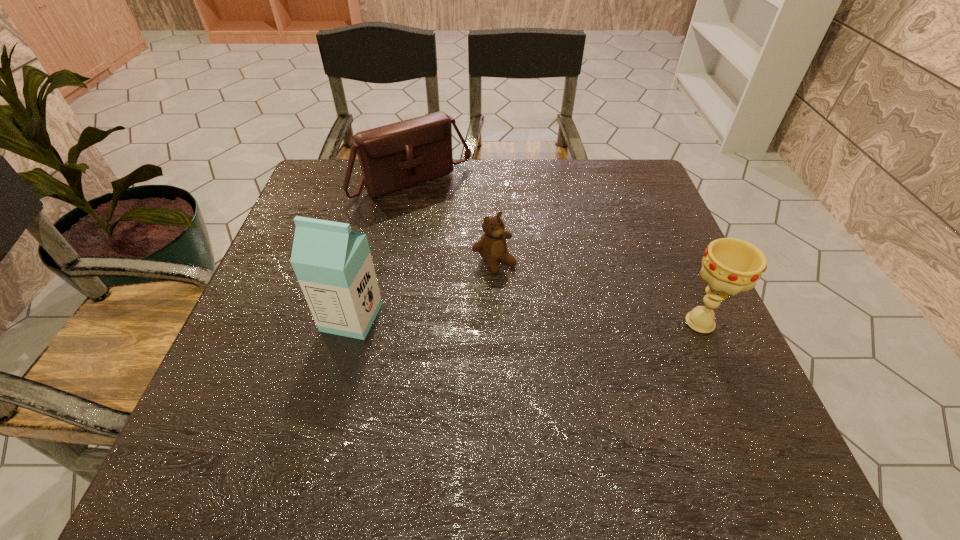
Identify the location of vacant space situated 0.290m at the face of the second farthest object. The height and width of the screenshot is (540, 960). (590, 369).

The width and height of the screenshot is (960, 540). I want to click on vacant space located 0.400m at the face of the second farthest object, so click(x=632, y=416).

This screenshot has width=960, height=540. Identify the location of free space located at the face of the second farthest object. (535, 306).

Image resolution: width=960 pixels, height=540 pixels. Identify the location of object positioned at the far edge. (396, 156).

Where is `milk carton that is at the left edge`? milk carton that is at the left edge is located at coordinates (333, 264).

Where is `shoulder bag that is at the left edge`? Image resolution: width=960 pixels, height=540 pixels. shoulder bag that is at the left edge is located at coordinates click(x=396, y=156).

This screenshot has width=960, height=540. Identify the location of object located in the right edge section of the desktop. (729, 266).

This screenshot has height=540, width=960. I want to click on object that is at the far left corner, so click(x=396, y=156).

This screenshot has width=960, height=540. Find the location of `blank space at the far edge of the desktop`. blank space at the far edge of the desktop is located at coordinates (442, 204).

You are a GUI agent. You are given a task and a screenshot of the screen. Output one action in this format:
    pyautogui.click(x=<x>, y=<y>)
    Task: Click on the free location at the near edge
    The width and height of the screenshot is (960, 540).
    Given the screenshot: What is the action you would take?
    pyautogui.click(x=500, y=416)